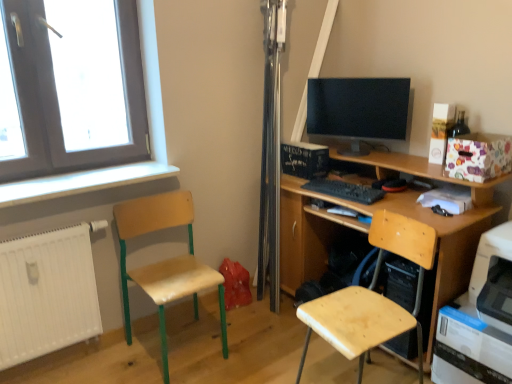
The image size is (512, 384). Find the location of `wooden desk at center`. wooden desk at center is located at coordinates (389, 210).

Identify the location of wooden seat at left, which is the second chair from right to left. This screenshot has width=512, height=384. (165, 261).

The height and width of the screenshot is (384, 512). I want to click on white plastic printer at lower right, so pos(479,319).

Is wooden seat at left, the 1th chair positioned from the left, aimed at white plastic printer at lower right?

No, wooden seat at left, the 1th chair positioned from the left, is not facing towards white plastic printer at lower right.

Looking at this image, can you tell me how much wooden seat at left, the 1th chair positioned from the left, and white plastic printer at lower right differ in facing direction?

The angle between the facing direction of wooden seat at left, the 1th chair positioned from the left, and the facing direction of white plastic printer at lower right is 89.7 degrees.

Is wooden seat at left, the 1th chair positioned from the left, far from white plastic printer at lower right?

Yes.

Is wooden seat at left, the 1th chair positioned from the left, completely or partially outside of white plastic printer at lower right?

That's correct, wooden seat at left, the 1th chair positioned from the left, is outside of white plastic printer at lower right.

From the image's perspective, is matte black monitor at center beneath white painted wood at left?

No, from the image's perspective, matte black monitor at center is not beneath white painted wood at left.

How much distance is there between matte black monitor at center and white painted wood at left?

They are 3.95 feet apart.

Is white painted wood at left inside matte black monitor at center?

No, white painted wood at left is not surrounded by matte black monitor at center.

Is matte black monitor at center wider than white painted wood at left?

No.

Does white painted wood at left have a lesser height compared to black matte keyboard at center?

In fact, white painted wood at left may be taller than black matte keyboard at center.

From a real-world perspective, is white painted wood at left under black matte keyboard at center?

Incorrect, from a real-world perspective, white painted wood at left is higher than black matte keyboard at center.

Between white painted wood at left and black matte keyboard at center, which one appears on the left side from the viewer's perspective?

Positioned to the left is white painted wood at left.

Looking at the image, does white painted wood at left seem bigger or smaller compared to black matte keyboard at center?

white painted wood at left is bigger than black matte keyboard at center.

Identify the location of desk above the white matte radiator at lower left (from the image's perspective). The width and height of the screenshot is (512, 384). (389, 210).

Which object is positioned more to the left, white matte radiator at lower left or wooden desk at center?

Positioned to the left is white matte radiator at lower left.

Between white matte radiator at lower left and wooden desk at center, which one has less height?

white matte radiator at lower left.

Considering the sizes of wooden desk at center and white plastic printer at lower right in the image, is wooden desk at center wider or thinner than white plastic printer at lower right?

wooden desk at center is wider than white plastic printer at lower right.

From a real-world perspective, is wooden desk at center above or below white plastic printer at lower right?

From a real-world perspective, wooden desk at center is physically above white plastic printer at lower right.

Is point (438, 299) positioned behind point (510, 272)?

Yes, it is.

Where is `desk on the left of white plastic printer at lower right`? desk on the left of white plastic printer at lower right is located at coordinates [x=389, y=210].

Considering the relative sizes of floral paper box at upper right and matte black monitor at center in the image provided, is floral paper box at upper right wider than matte black monitor at center?

Correct, the width of floral paper box at upper right exceeds that of matte black monitor at center.

Can you confirm if floral paper box at upper right is positioned to the right of matte black monitor at center?

Correct, you'll find floral paper box at upper right to the right of matte black monitor at center.

From a real-world perspective, is floral paper box at upper right positioned over matte black monitor at center based on gravity?

No, from a real-world perspective, floral paper box at upper right is not above matte black monitor at center.

Is white matte radiator at lower left inside floral paper box at upper right?

No, white matte radiator at lower left is not a part of floral paper box at upper right.

Considering the positions of objects floral paper box at upper right and white matte radiator at lower left in the image provided, who is in front, floral paper box at upper right or white matte radiator at lower left?

Positioned in front is white matte radiator at lower left.

Is floral paper box at upper right wider or thinner than white matte radiator at lower left?

In the image, floral paper box at upper right appears to be wider than white matte radiator at lower left.

Is point (479, 173) positioned behind point (60, 340)?

No.

Find the location of a particular element. This screenshot has height=384, width=512. chair above the white plastic printer at lower right (from the image's perspective) is located at coordinates (165, 261).

At what (x,y) coordinates should I click in order to perform the action: click on window sill beneath the matte black monitor at center (from a real-world perspective). Please return your answer as a coordinate pair (x, y). This screenshot has height=384, width=512. Looking at the image, I should click on (82, 182).

When comparing their distances from wooden chair at lower right, acting as the first chair starting from the right, does matte black monitor at center or white plastic printer at lower right seem further?

matte black monitor at center lies further to wooden chair at lower right, acting as the first chair starting from the right, than the other object.

Which object lies further to the anchor point matte black monitor at center, white matte radiator at lower left or wooden chair at lower right, which appears as the 2th chair when viewed from the left?

white matte radiator at lower left lies further to matte black monitor at center than the other object.

Considering their positions, is matte black monitor at center positioned closer to white matte radiator at lower left than wooden chair at lower right, which appears as the 2th chair when viewed from the left?

wooden chair at lower right, which appears as the 2th chair when viewed from the left, is closer to white matte radiator at lower left.

Looking at the image, which one is located closer to white painted wood at left, black matte keyboard at center or wooden seat at left, the 1th chair positioned from the left?

wooden seat at left, the 1th chair positioned from the left, is positioned closer to the anchor white painted wood at left.

Based on their spatial positions, is matte black monitor at center or white painted wood at left further from white plastic printer at lower right?

white painted wood at left is positioned further to the anchor white plastic printer at lower right.

When comparing their distances from wooden seat at left, the 1th chair positioned from the left, does floral paper box at upper right or white plastic printer at lower right seem further?

floral paper box at upper right is positioned further to the anchor wooden seat at left, the 1th chair positioned from the left.

Looking at the image, which one is located closer to wooden desk at center, wooden chair at lower right, acting as the first chair starting from the right, or white painted wood at left?

wooden chair at lower right, acting as the first chair starting from the right, lies closer to wooden desk at center than the other object.

Estimate the real-world distances between objects in this image. Which object is closer to black matte keyboard at center, wooden desk at center or white plastic printer at lower right?

wooden desk at center is positioned closer to the anchor black matte keyboard at center.

Image resolution: width=512 pixels, height=384 pixels. I want to click on keyboard between white painted wood at left and white plastic printer at lower right, so click(x=345, y=190).

This screenshot has width=512, height=384. I want to click on keyboard between wooden seat at left, which is the second chair from right to left, and matte black monitor at center, so click(x=345, y=190).

Where is `keyboard between white matte radiator at lower left and floral paper box at upper right from left to right`? This screenshot has height=384, width=512. keyboard between white matte radiator at lower left and floral paper box at upper right from left to right is located at coordinates (345, 190).

Where is `desk between white matte radiator at lower left and white plastic printer at lower right in the horizontal direction`? This screenshot has width=512, height=384. desk between white matte radiator at lower left and white plastic printer at lower right in the horizontal direction is located at coordinates (389, 210).